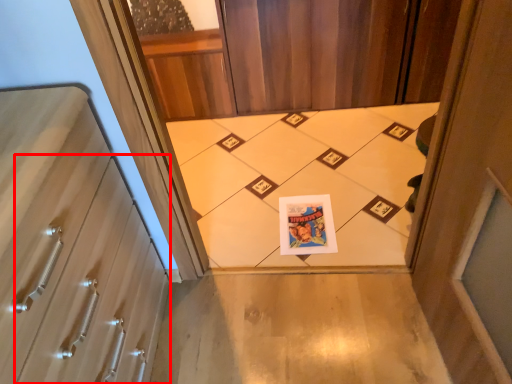
Question: From the image's perspective, considering the relative positions of drawer (annotated by the red box) and print in the image provided, where is drawer (annotated by the red box) located with respect to the staircase?

Choices:
 (A) below
 (B) above

Answer: (A)